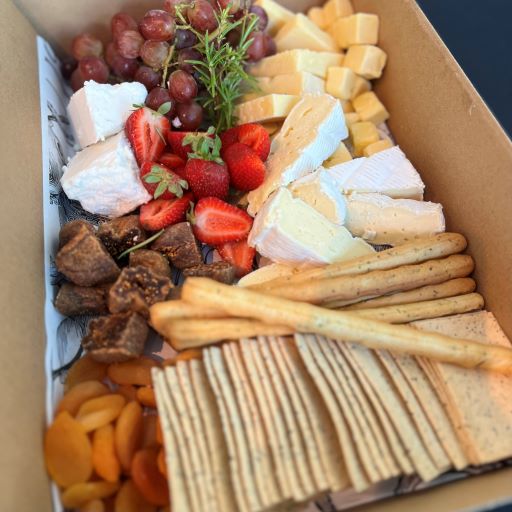
Find the location of `box`. box is located at coordinates (448, 142), (14, 341).